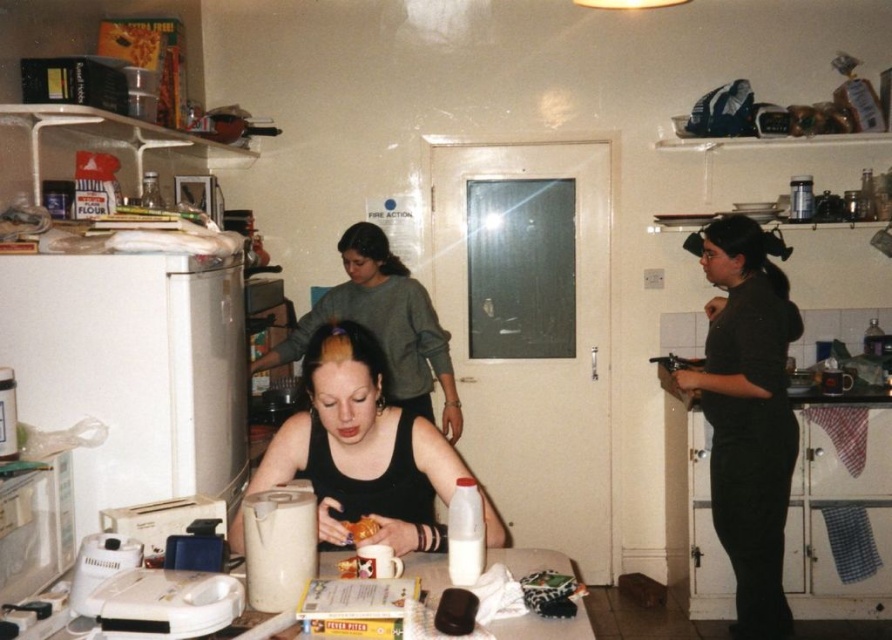
From the picture: In the kitchen scene, there is a white plastic refrigerator at left and a white plastic milk bottle at center. Which object is positioned to the left of the other?

The white plastic refrigerator at left is to the left of the white plastic milk bottle at center.